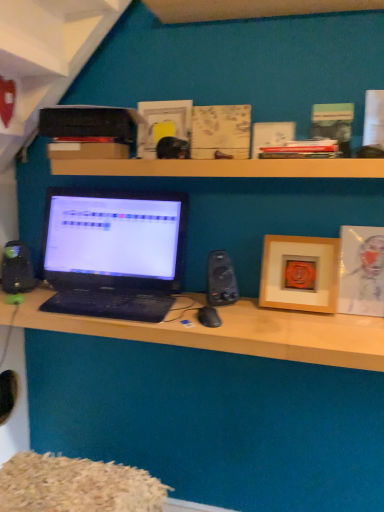
The image size is (384, 512). I want to click on free spot above matte black laptop at center (from a real-world perspective), so click(192, 314).